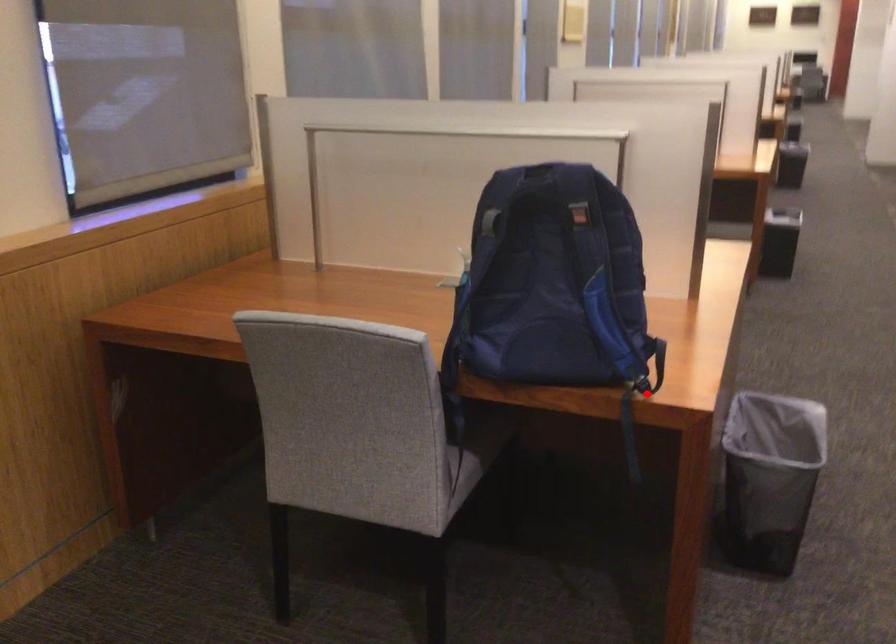
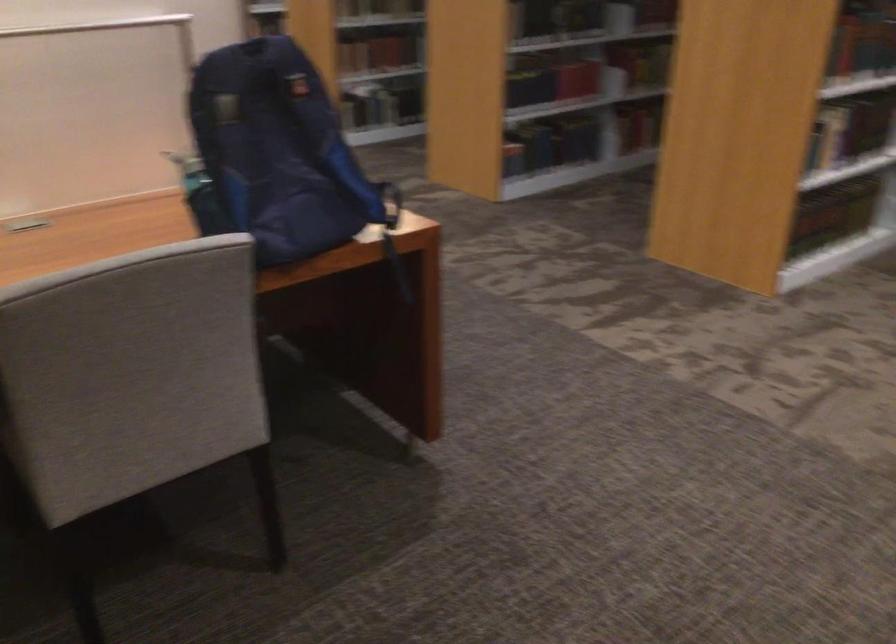
Question: I am providing you with two images of the same scene from different viewpoints. Given a red point in image1, look at the same physical point in image2. Is it:

Choices:
 (A) Closer to the viewpoint
 (B) Farther from the viewpoint

Answer: (B)